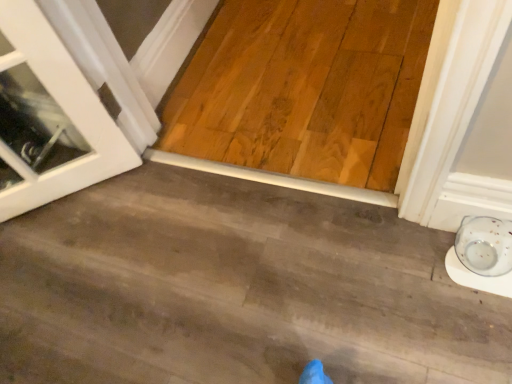
The width and height of the screenshot is (512, 384). Find the location of `empty space that is ontop of wooden at center (from a real-world perspective)`. empty space that is ontop of wooden at center (from a real-world perspective) is located at coordinates (198, 276).